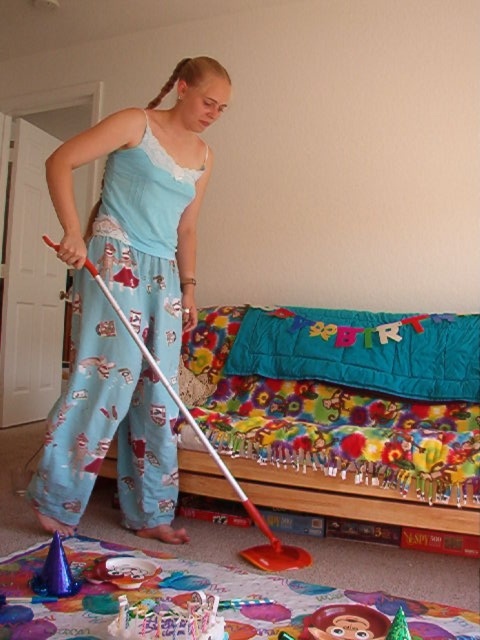
Does light blue satin pajama set at center have a lesser width compared to floral fabric bed at center?

Correct, light blue satin pajama set at center's width is less than floral fabric bed at center's.

Who is more distant from viewer, (79, 518) or (284, 499)?

The point (284, 499) is more distant.

Is point (191, 99) more distant than point (374, 433)?

No, it is in front of (374, 433).

Identify the location of light blue satin pajama set at center. (130, 301).